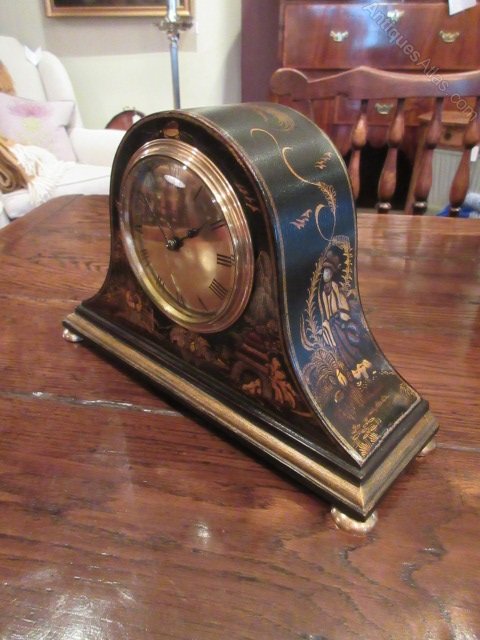
The image size is (480, 640). I want to click on hands of the clock, so click(188, 234), click(166, 234).